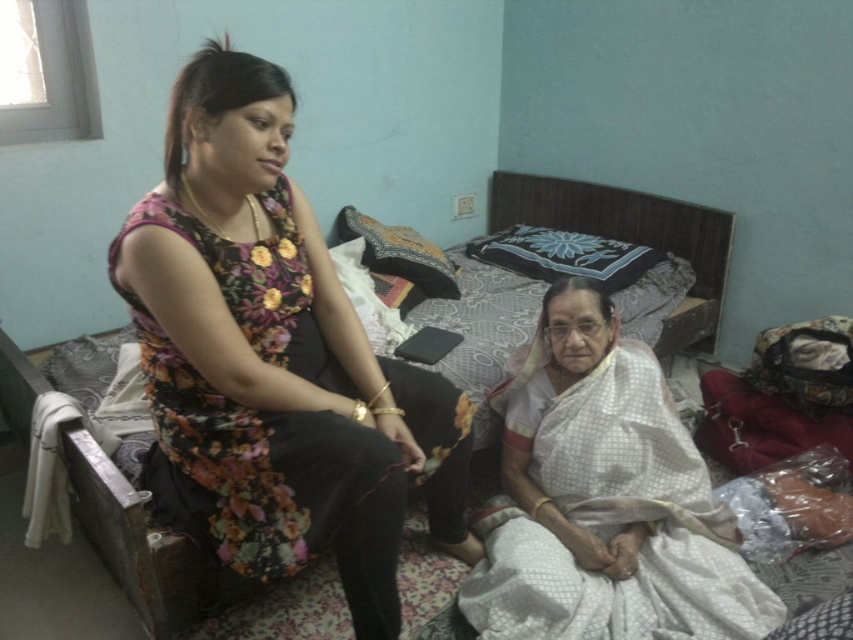
Question: Can you confirm if floral fabric dress at left is bigger than white silk saree at lower right?

Choices:
 (A) yes
 (B) no

Answer: (A)

Question: Which object is positioned farthest from the patterned fabric bed at center?

Choices:
 (A) white silk saree at lower right
 (B) floral fabric dress at left

Answer: (B)

Question: Observing the image, what is the correct spatial positioning of floral fabric dress at left in reference to white silk saree at lower right?

Choices:
 (A) right
 (B) left

Answer: (B)

Question: Based on their relative distances, which object is nearer to the patterned fabric bed at center?

Choices:
 (A) floral fabric dress at left
 (B) white silk saree at lower right

Answer: (B)

Question: Which object is the closest to the floral fabric dress at left?

Choices:
 (A) patterned fabric bed at center
 (B) white silk saree at lower right

Answer: (B)

Question: Is floral fabric dress at left thinner than patterned fabric bed at center?

Choices:
 (A) yes
 (B) no

Answer: (A)